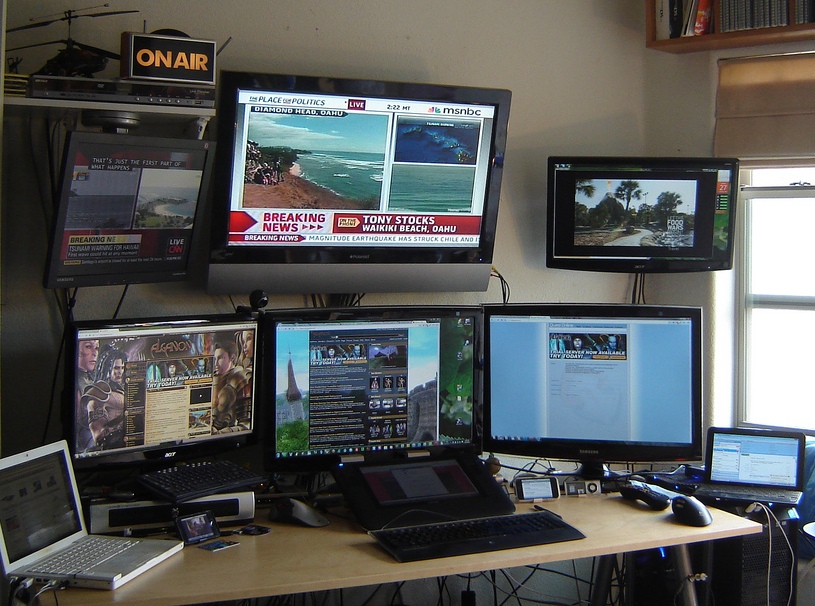
Locate an element on the screen. This screenshot has height=606, width=815. keyboard is located at coordinates (82, 553), (468, 534), (430, 487), (746, 487).